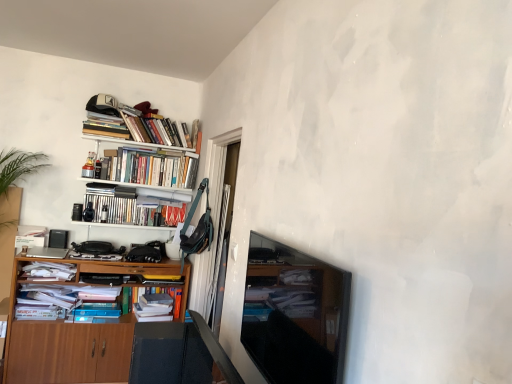
Question: In which direction should I rotate to look at hardcover books at center, which is counted as the fifth book, starting from the top?

Choices:
 (A) right
 (B) left

Answer: (B)

Question: Is hardcover books at upper left, marked as the third book in a top-to-bottom arrangement, shorter than hardcover books at upper left, which is the 2th book from bottom to top?

Choices:
 (A) no
 (B) yes

Answer: (A)

Question: Can you confirm if hardcover books at upper left, marked as the third book in a top-to-bottom arrangement, is wider than hardcover books at upper left, marked as the 4th book in a top-to-bottom arrangement?

Choices:
 (A) no
 (B) yes

Answer: (B)

Question: Is hardcover books at upper left, the third book from the bottom, at the right side of hardcover books at upper left, marked as the 4th book in a top-to-bottom arrangement?

Choices:
 (A) yes
 (B) no

Answer: (A)

Question: Is hardcover books at upper left, the third book from the bottom, bigger than hardcover books at upper left, which is the 2th book from bottom to top?

Choices:
 (A) no
 (B) yes

Answer: (B)

Question: From the image's perspective, is hardcover books at upper left, the third book from the bottom, under hardcover books at upper left, marked as the 4th book in a top-to-bottom arrangement?

Choices:
 (A) no
 (B) yes

Answer: (A)

Question: From a real-world perspective, is hardcover books at upper left, marked as the third book in a top-to-bottom arrangement, located higher than hardcover books at upper left, marked as the 4th book in a top-to-bottom arrangement?

Choices:
 (A) yes
 (B) no

Answer: (A)

Question: From the image's perspective, is hardcover books at upper left, the first book when ordered from top to bottom, over matte black tv at center?

Choices:
 (A) no
 (B) yes

Answer: (B)

Question: Considering the relative positions of hardcover books at upper left, the first book when ordered from top to bottom, and matte black tv at center in the image provided, is hardcover books at upper left, the first book when ordered from top to bottom, to the left of matte black tv at center from the viewer's perspective?

Choices:
 (A) yes
 (B) no

Answer: (A)

Question: Can you confirm if hardcover books at upper left, the first book when ordered from top to bottom, is shorter than matte black tv at center?

Choices:
 (A) no
 (B) yes

Answer: (B)

Question: Does hardcover books at upper left, the first book when ordered from top to bottom, contain matte black tv at center?

Choices:
 (A) no
 (B) yes

Answer: (A)

Question: Is the position of hardcover books at upper left, the first book when ordered from top to bottom, less distant than that of matte black tv at center?

Choices:
 (A) no
 (B) yes

Answer: (A)

Question: Can you confirm if hardcover books at upper left, the first book when ordered from top to bottom, is thinner than matte black tv at center?

Choices:
 (A) yes
 (B) no

Answer: (B)

Question: Considering the relative sizes of wooden cabinet at left and hardcover books at upper left, marked as the 4th book in a top-to-bottom arrangement, in the image provided, is wooden cabinet at left shorter than hardcover books at upper left, marked as the 4th book in a top-to-bottom arrangement,?

Choices:
 (A) no
 (B) yes

Answer: (A)